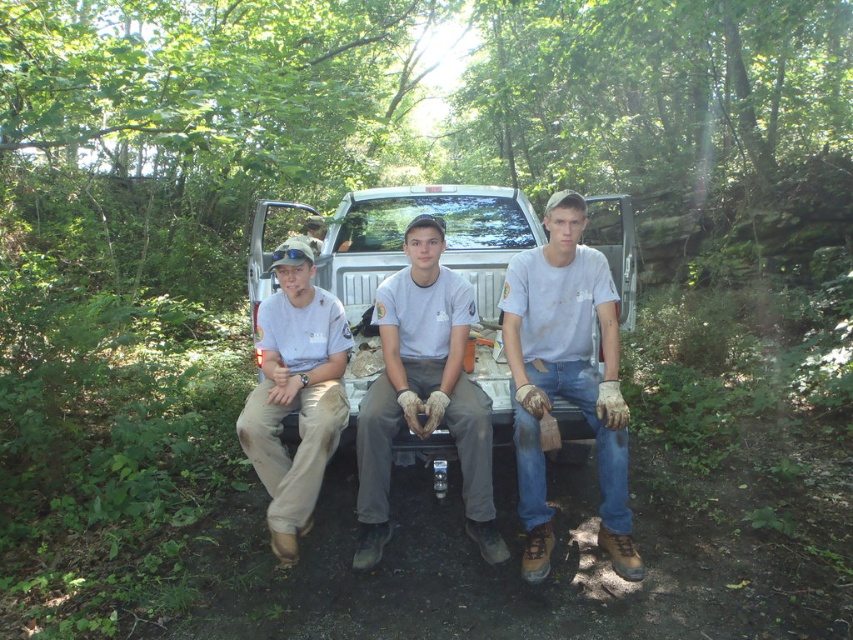
You are a photographer trying to capture a group photo of the gray cotton shirt at center and the tan fabric shirt at center. The camera you have can only focus on objects within a 12 inch range. Will both subjects be in focus?

The distance between the gray cotton shirt at center and the tan fabric shirt at center is 15.31 inches. Since the camera can only focus within a 12 inch range, the subjects are slightly out of the focus range. Therefore, both may not be in focus simultaneously.

You are a photographer taking a group photo of the two people wearing the worn denim jeans at center and gray cotton shirt at center. To make sure both are centered in the frame, should you adjust the camera to the left or right? Explain your reasoning based on their positions.

The worn denim jeans at center is positioned on the right side of gray cotton shirt at center. To center both in the frame, you should adjust the camera slightly to the right to account for the denim jeans being on the right side of the gray cotton shirt, ensuring both are equally visible.

In the scene shown: You are standing in front of the pickup truck and want to reach both the point at (512, 294) and the point at (338, 403). Which point will you reach first?

The point at (512, 294) is closer to you, so you will reach it first.